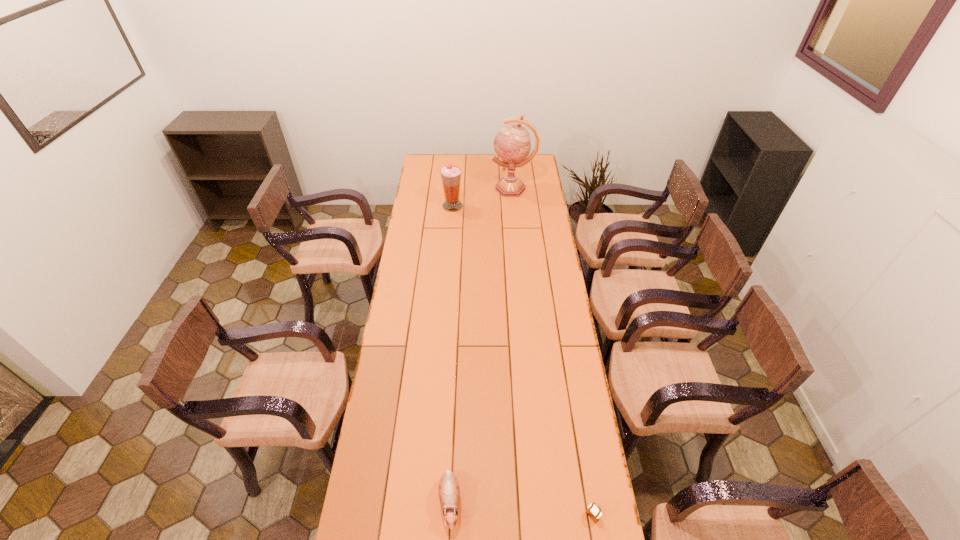
You are a GUI agent. You are given a task and a screenshot of the screen. Output one action in this format:
    pyautogui.click(x=<x>, y=<y>)
    Task: Click on the tallest object
    
    Given the screenshot: What is the action you would take?
    pyautogui.click(x=512, y=144)

At what (x,y) coordinates should I click in order to perform the action: click on globe. Please return your answer as a coordinate pair (x, y). This screenshot has height=540, width=960. Looking at the image, I should click on (512, 144).

This screenshot has height=540, width=960. In order to click on the third shortest object in this screenshot , I will do `click(450, 175)`.

In order to click on the third nearest object in this screenshot , I will do `click(450, 175)`.

The height and width of the screenshot is (540, 960). I want to click on hamster, so click(x=449, y=492).

Identify the location of padlock. (594, 513).

Where is `vacant space situated 0.080m on the front-facing side of the tallest object`? Image resolution: width=960 pixels, height=540 pixels. vacant space situated 0.080m on the front-facing side of the tallest object is located at coordinates (476, 188).

The height and width of the screenshot is (540, 960). Find the location of `vacant space located 0.290m on the front-facing side of the tallest object`. vacant space located 0.290m on the front-facing side of the tallest object is located at coordinates (441, 188).

Image resolution: width=960 pixels, height=540 pixels. What are the coordinates of `vacant space positioned 0.340m on the front-facing side of the tallest object` in the screenshot? It's located at 432,188.

Where is `vacant space situated on the front of the third shortest object`? The width and height of the screenshot is (960, 540). vacant space situated on the front of the third shortest object is located at coordinates (451, 228).